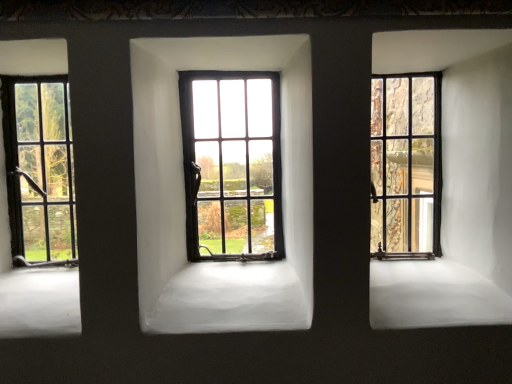
Question: Is matte black window at center, arranged as the second window when viewed from the right, beside matte black window at left, the third window viewed from the right?

Choices:
 (A) yes
 (B) no

Answer: (B)

Question: Is matte black window at center, arranged as the second window when viewed from the right, thinner than matte black window at left, the third window viewed from the right?

Choices:
 (A) no
 (B) yes

Answer: (A)

Question: Is matte black window at center, which is the 2th window from left to right, aimed at matte black window at left, the third window viewed from the right?

Choices:
 (A) yes
 (B) no

Answer: (B)

Question: From a real-world perspective, is matte black window at center, arranged as the second window when viewed from the right, positioned under matte black window at left, the third window viewed from the right, based on gravity?

Choices:
 (A) no
 (B) yes

Answer: (A)

Question: From a real-world perspective, is matte black window at center, which is the 2th window from left to right, on matte black window at left, the 1th window in the left-to-right sequence?

Choices:
 (A) no
 (B) yes

Answer: (B)

Question: Is matte black window at center, which is the 2th window from left to right, not close to matte black window at left, the third window viewed from the right?

Choices:
 (A) yes
 (B) no

Answer: (B)

Question: From the image's perspective, is matte black window at left, the 1th window in the left-to-right sequence, located beneath matte black window at right, positioned as the 3th window in left-to-right order?

Choices:
 (A) yes
 (B) no

Answer: (A)

Question: Is there a large distance between matte black window at left, the 1th window in the left-to-right sequence, and matte black window at right, marked as the 1th window in a right-to-left arrangement?

Choices:
 (A) yes
 (B) no

Answer: (A)

Question: Is matte black window at left, the 1th window in the left-to-right sequence, in front of matte black window at right, marked as the 1th window in a right-to-left arrangement?

Choices:
 (A) yes
 (B) no

Answer: (A)

Question: Is matte black window at left, the third window viewed from the right, beside matte black window at right, positioned as the 3th window in left-to-right order?

Choices:
 (A) yes
 (B) no

Answer: (B)

Question: From the image's perspective, is matte black window at left, the third window viewed from the right, over matte black window at right, marked as the 1th window in a right-to-left arrangement?

Choices:
 (A) yes
 (B) no

Answer: (B)

Question: Is matte black window at left, the 1th window in the left-to-right sequence, bigger than matte black window at right, marked as the 1th window in a right-to-left arrangement?

Choices:
 (A) no
 (B) yes

Answer: (A)

Question: Is matte black window at center, arranged as the second window when viewed from the right, beside matte black window at right, positioned as the 3th window in left-to-right order?

Choices:
 (A) yes
 (B) no

Answer: (B)